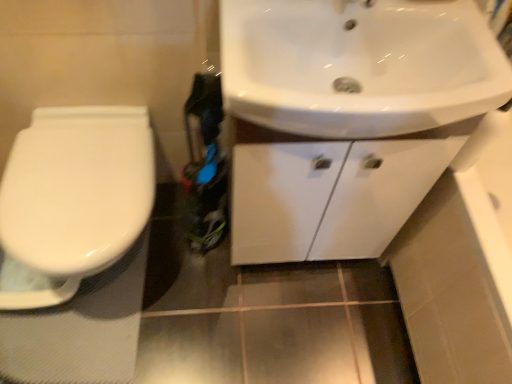
Locate an element on the screen. vacant space in front of white glossy cabinet at upper right is located at coordinates (288, 329).